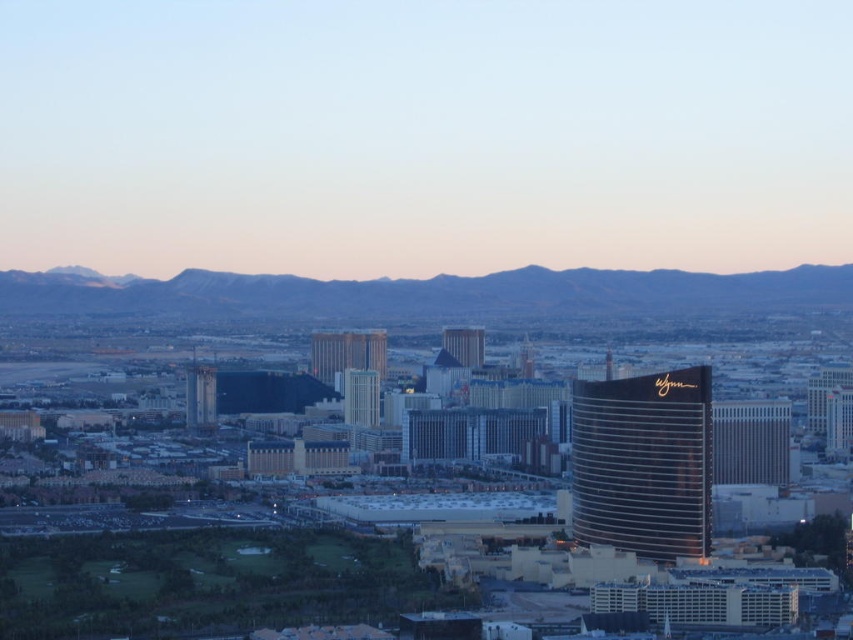
Question: Which point is closer to the camera?

Choices:
 (A) gray rocky mountains at center
 (B) metallic silver hotel at right
 (C) shiny gold hotel at center right

Answer: (A)

Question: Can you confirm if gray rocky mountains at center is bigger than metallic silver hotel at right?

Choices:
 (A) yes
 (B) no

Answer: (A)

Question: In this image, where is gray rocky mountains at center located relative to metallic silver hotel at right?

Choices:
 (A) below
 (B) above

Answer: (B)

Question: Which point is closer to the camera taking this photo?

Choices:
 (A) (624, 509)
 (B) (283, 294)
 (C) (785, 458)

Answer: (B)

Question: In this image, where is shiny gold hotel at center right located relative to metallic silver hotel at right?

Choices:
 (A) below
 (B) above

Answer: (A)

Question: Among these points, which one is nearest to the camera?

Choices:
 (A) (807, 266)
 (B) (785, 406)
 (C) (610, 474)

Answer: (C)